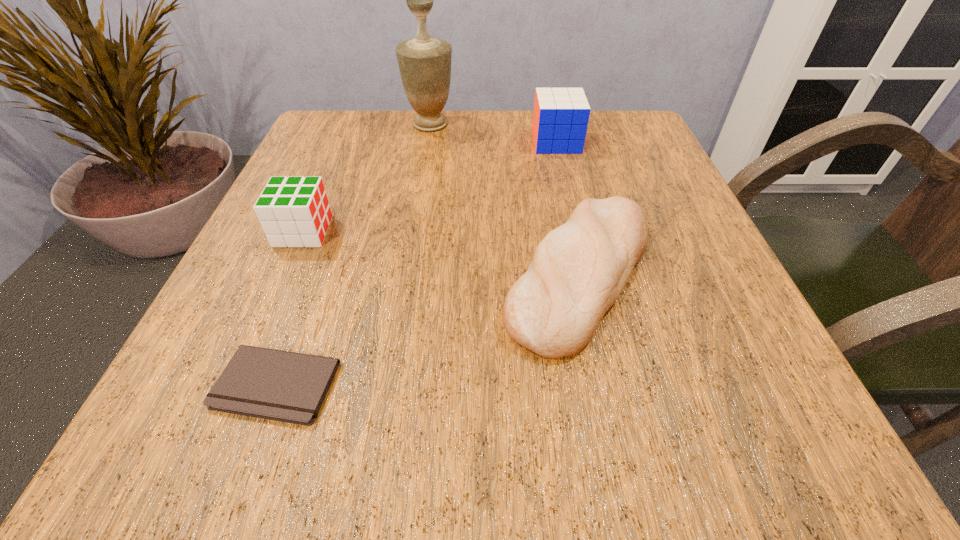
Locate an element on the screen. The height and width of the screenshot is (540, 960). urn is located at coordinates (425, 63).

The width and height of the screenshot is (960, 540). In order to click on the third object from left to right in this screenshot , I will do `click(425, 63)`.

You are a GUI agent. You are given a task and a screenshot of the screen. Output one action in this format:
    pyautogui.click(x=<x>, y=<y>)
    Task: Click on the farther cube
    This screenshot has height=540, width=960.
    Given the screenshot: What is the action you would take?
    pyautogui.click(x=560, y=119)

Image resolution: width=960 pixels, height=540 pixels. Find the location of `the right cube`. the right cube is located at coordinates point(560,119).

Where is `the shorter cube`? the shorter cube is located at coordinates (295, 212).

Identify the location of the nearer cube. The width and height of the screenshot is (960, 540). (295, 212).

Find the location of a particular element. The height and width of the screenshot is (540, 960). bread is located at coordinates (578, 271).

Where is `the shortest object`? The image size is (960, 540). the shortest object is located at coordinates (272, 384).

You are a GUI agent. You are given a task and a screenshot of the screen. Output one action in this format:
    pyautogui.click(x=<x>, y=<y>)
    Task: Click on the blank space located 0.210m on the front of the tallest object
    The image size is (960, 540).
    Given the screenshot: What is the action you would take?
    pyautogui.click(x=420, y=192)

The height and width of the screenshot is (540, 960). What are the coordinates of `vacant space situated 0.070m on the right of the taller cube` in the screenshot? It's located at (612, 142).